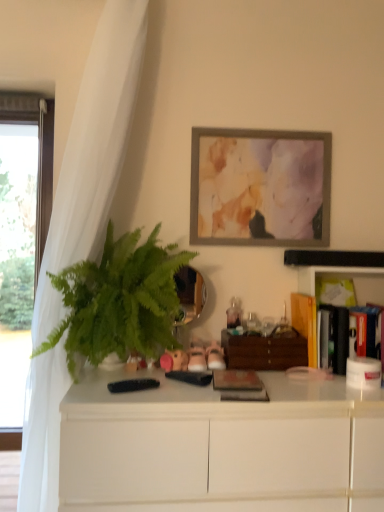
What are the coordinates of `vacant area that is in front of rustic wooden book at center, which ranks as the third book in back-to-front order` in the screenshot? It's located at (240, 407).